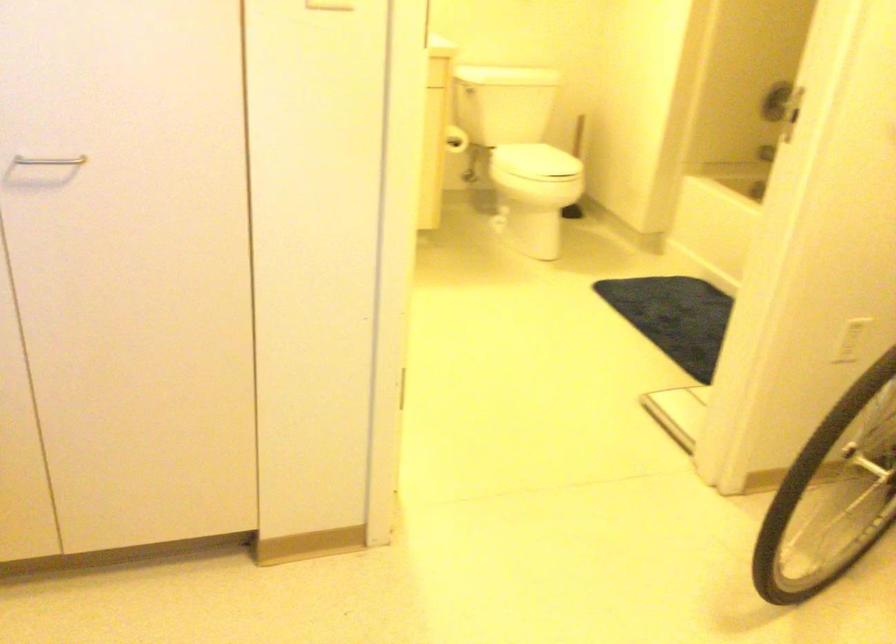
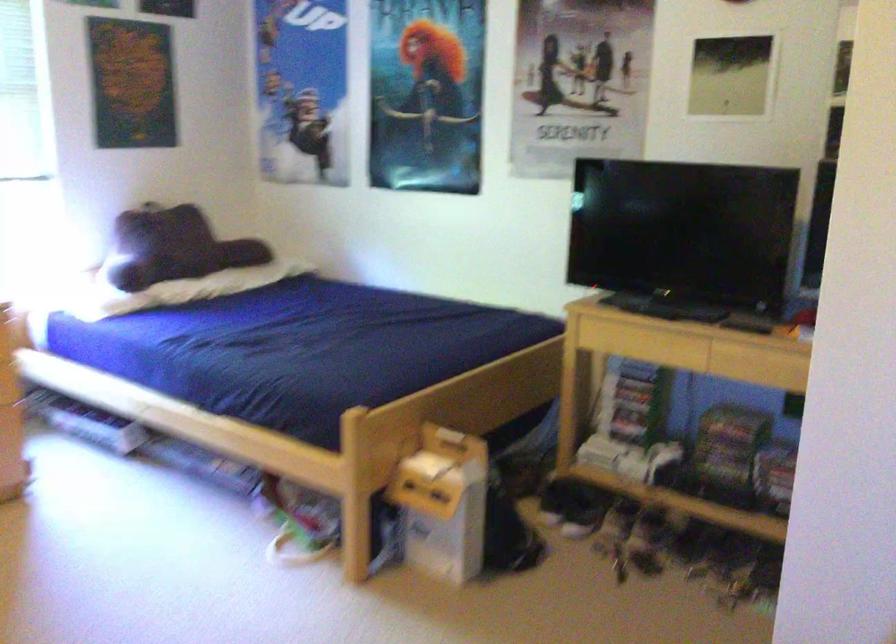
Question: How did the camera likely rotate?

Choices:
 (A) Left
 (B) Right
 (C) Up
 (D) Down

Answer: (A)